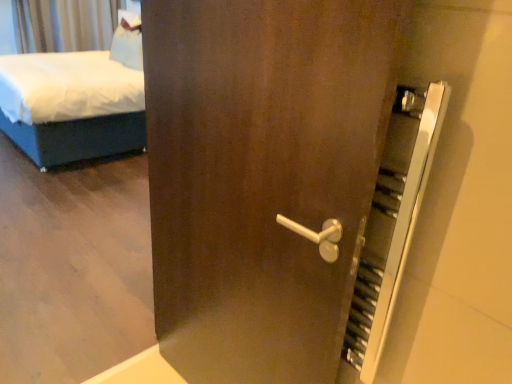
You are a GUI agent. You are given a task and a screenshot of the screen. Output one action in this format:
    pyautogui.click(x=<x>, y=<y>)
    Task: Click on the white fabric bed at left
    
    Given the screenshot: What is the action you would take?
    pyautogui.click(x=71, y=84)

Describe the element at coordinates (71, 84) in the screenshot. The width and height of the screenshot is (512, 384). I see `white fabric bed at left` at that location.

At what (x,y) coordinates should I click in order to perform the action: click on silky gray curtain at upper left. Please return your answer as a coordinate pair (x, y). The height and width of the screenshot is (384, 512). Looking at the image, I should click on (64, 24).

The image size is (512, 384). Describe the element at coordinates (64, 24) in the screenshot. I see `silky gray curtain at upper left` at that location.

The height and width of the screenshot is (384, 512). What are the coordinates of `white fabric bed at left` in the screenshot? It's located at (71, 84).

Based on the photo, considering the relative positions of white fabric bed at left and silky gray curtain at upper left in the image provided, is white fabric bed at left to the right of silky gray curtain at upper left from the viewer's perspective?

Indeed, white fabric bed at left is positioned on the right side of silky gray curtain at upper left.

In the image, is white fabric bed at left positioned in front of or behind silky gray curtain at upper left?

Visually, white fabric bed at left is located in front of silky gray curtain at upper left.

Between point (75, 99) and point (96, 25), which one is positioned in front?

Positioned in front is point (75, 99).

From the image's perspective, is white fabric bed at left positioned above or below silky gray curtain at upper left?

white fabric bed at left is situated lower than silky gray curtain at upper left in the image.

From a real-world perspective, is white fabric bed at left above or below silky gray curtain at upper left?

In terms of real-world spatial position, white fabric bed at left is below silky gray curtain at upper left.

Between white fabric bed at left and silky gray curtain at upper left, which one has smaller width?

silky gray curtain at upper left is thinner.

From their relative heights in the image, would you say white fabric bed at left is taller or shorter than silky gray curtain at upper left?

Clearly, white fabric bed at left is taller compared to silky gray curtain at upper left.

Is white fabric bed at left bigger or smaller than silky gray curtain at upper left?

Clearly, white fabric bed at left is larger in size than silky gray curtain at upper left.

Does white fabric bed at left contain silky gray curtain at upper left?

That's incorrect, silky gray curtain at upper left is not inside white fabric bed at left.

Are white fabric bed at left and silky gray curtain at upper left far apart?

Yes, white fabric bed at left and silky gray curtain at upper left are located far from each other.

Is white fabric bed at left turned away from silky gray curtain at upper left?

white fabric bed at left does not have its back to silky gray curtain at upper left.

You are a GUI agent. You are given a task and a screenshot of the screen. Output one action in this format:
    pyautogui.click(x=<x>, y=<y>)
    Task: Click on the curtain on the left of white fabric bed at left
    The width and height of the screenshot is (512, 384).
    Given the screenshot: What is the action you would take?
    64,24

Considering the relative positions of silky gray curtain at upper left and white fabric bed at left in the image provided, is silky gray curtain at upper left to the left or to the right of white fabric bed at left?

Clearly, silky gray curtain at upper left is on the left of white fabric bed at left in the image.

Is silky gray curtain at upper left further to the viewer compared to white fabric bed at left?

That is True.

Which is behind, point (36, 3) or point (125, 94)?

The point (36, 3) is farther.

From the image's perspective, would you say silky gray curtain at upper left is positioned over white fabric bed at left?

Yes, from the image's perspective, silky gray curtain at upper left is on top of white fabric bed at left.

Based on the photo, from a real-world perspective, between silky gray curtain at upper left and white fabric bed at left, who is vertically higher?

silky gray curtain at upper left, from a real-world perspective.

Between silky gray curtain at upper left and white fabric bed at left, which one has smaller width?

silky gray curtain at upper left is thinner.

In terms of height, does silky gray curtain at upper left look taller or shorter compared to white fabric bed at left?

In the image, silky gray curtain at upper left appears to be shorter than white fabric bed at left.

Who is smaller, silky gray curtain at upper left or white fabric bed at left?

Smaller between the two is silky gray curtain at upper left.

Can we say silky gray curtain at upper left lies outside white fabric bed at left?

Yes, silky gray curtain at upper left is not within white fabric bed at left.

Is the surface of silky gray curtain at upper left in direct contact with white fabric bed at left?

No, silky gray curtain at upper left is not in contact with white fabric bed at left.

Is silky gray curtain at upper left facing away from white fabric bed at left?

silky gray curtain at upper left does not have its back to white fabric bed at left.

Where is `curtain that appears behind the white fabric bed at left`? The image size is (512, 384). curtain that appears behind the white fabric bed at left is located at coordinates (64, 24).

Identify the location of bed below the silky gray curtain at upper left (from a real-world perspective). (71, 84).

The image size is (512, 384). Identify the location of curtain lying above the white fabric bed at left (from the image's perspective). (64, 24).